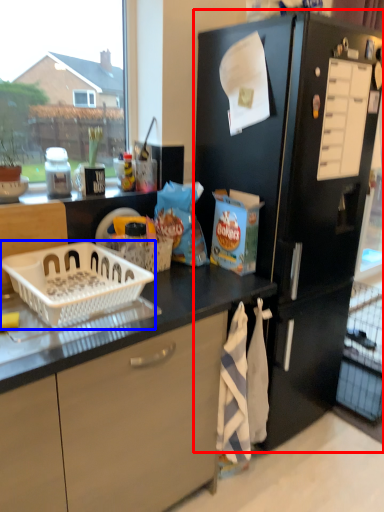
Question: Which object is further to the camera taking this photo, refrigerator (highlighted by a red box) or basket (highlighted by a blue box)?

Choices:
 (A) refrigerator
 (B) basket

Answer: (A)